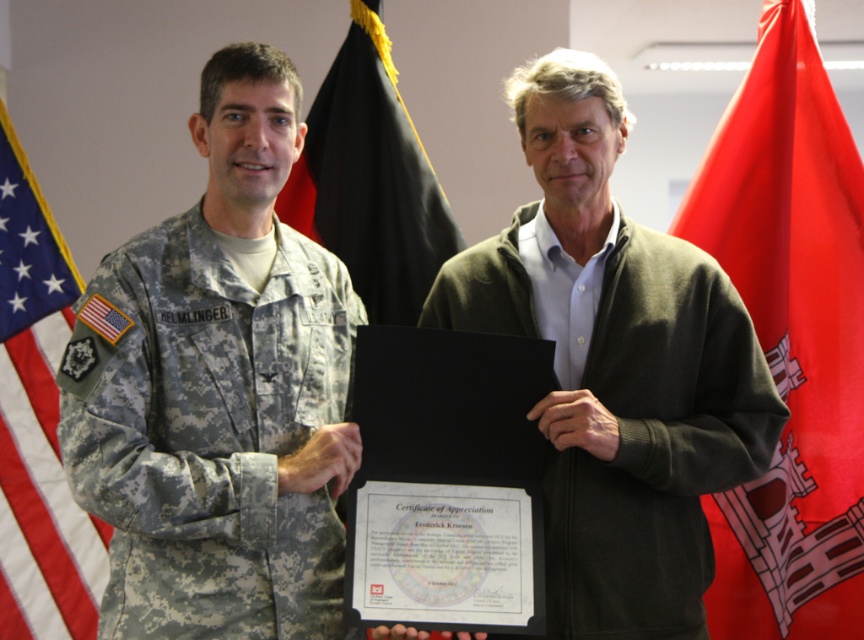
You are a tailor who needs to determine which fabric item requires more material between the camouflage fabric uniform at left and the red fabric flag at right. Based on the scene, which one would need more fabric?

The camouflage fabric uniform at left requires more fabric because it is larger in size than the red fabric flag at right.

You are a photographer who needs to adjust the lighting in the scene to ensure the certificate is well lit. Given the position of the american flag at left at point (37,422), where should you place the light source to avoid casting shadows on the certificate?

The american flag at left is located at point (37,422). To avoid casting shadows on the certificate, position the light source opposite to the flag, ensuring light reaches the certificate without obstruction.